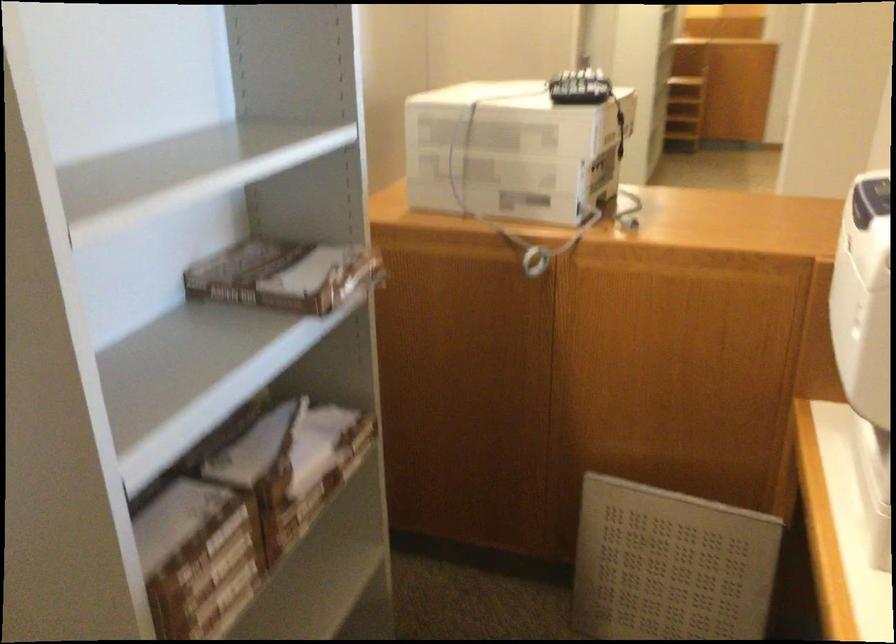
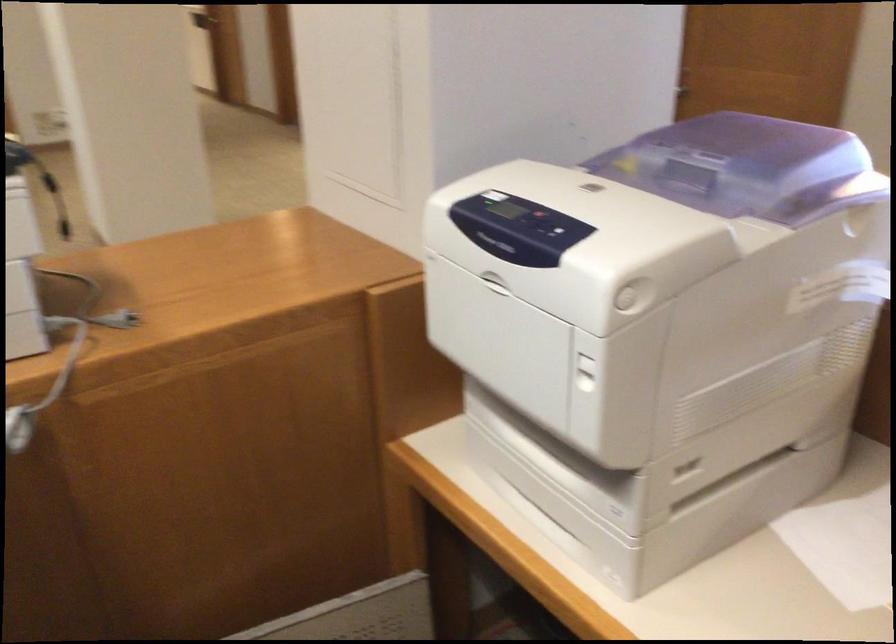
Question: The images are taken continuously from a first-person perspective. In which direction is your viewpoint rotating?

Choices:
 (A) Left
 (B) Right
 (C) Up
 (D) Down

Answer: (B)